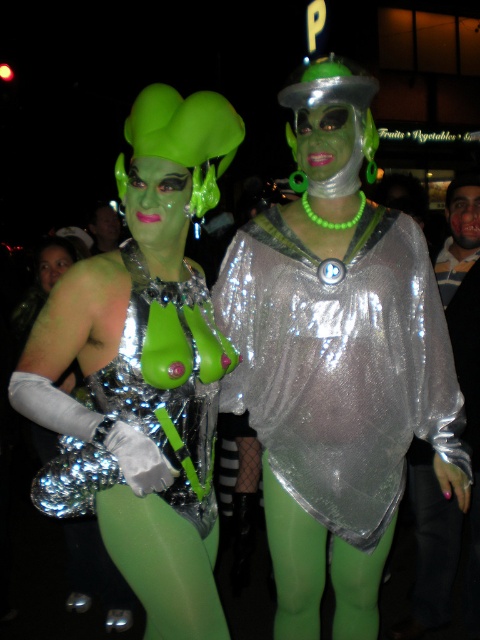
You are a photographer at a costume party. You need to position a spotlight at point [144,371] on the image. Which object will the spotlight illuminate?

The point [144,371] corresponds to the green metallic dress at center, so the spotlight will illuminate the green metallic dress at center.

You are a photographer at a costume party. You need to take a photo of the shiny metallic top at center and the green matte face paint at right. Which object should you focus on first if you want to capture both in one shot?

The shiny metallic top at center is much taller than the green matte face paint at right, so you should focus on the shiny metallic top at center first to ensure both are in frame.

Where is the shiny metallic dress at center located in the image?

The shiny metallic dress at center is located at point (168, 380).